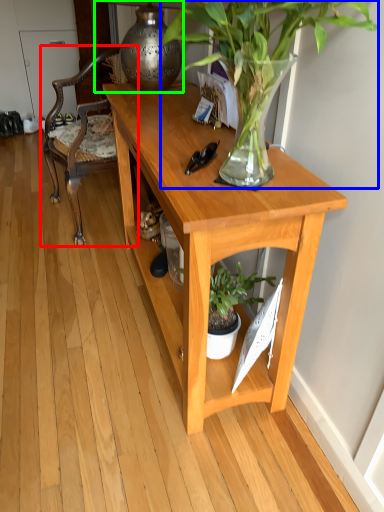
Question: Which object is the closest to the chair (highlighted by a red box)? Choose among these: houseplant (highlighted by a blue box) or lamp (highlighted by a green box).

Choices:
 (A) houseplant
 (B) lamp

Answer: (B)